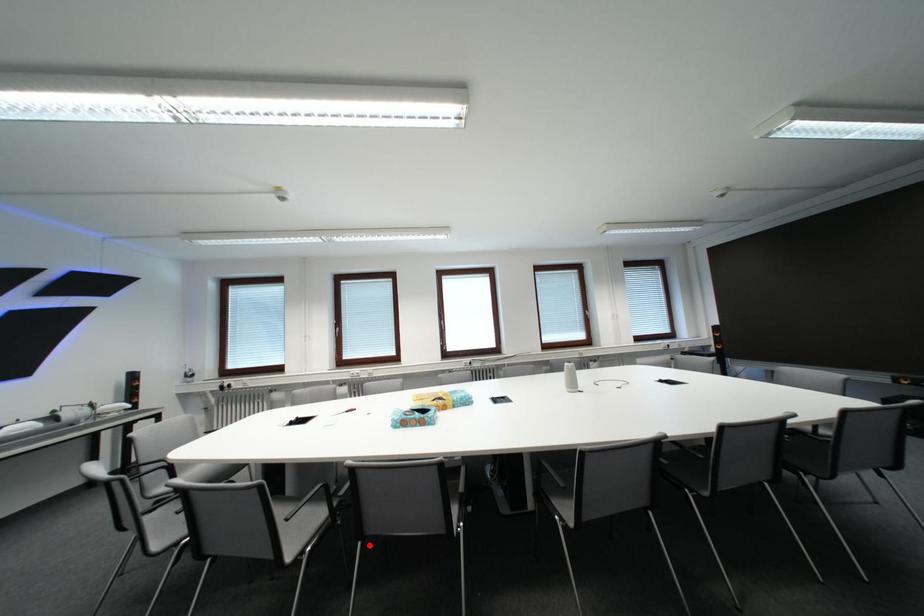
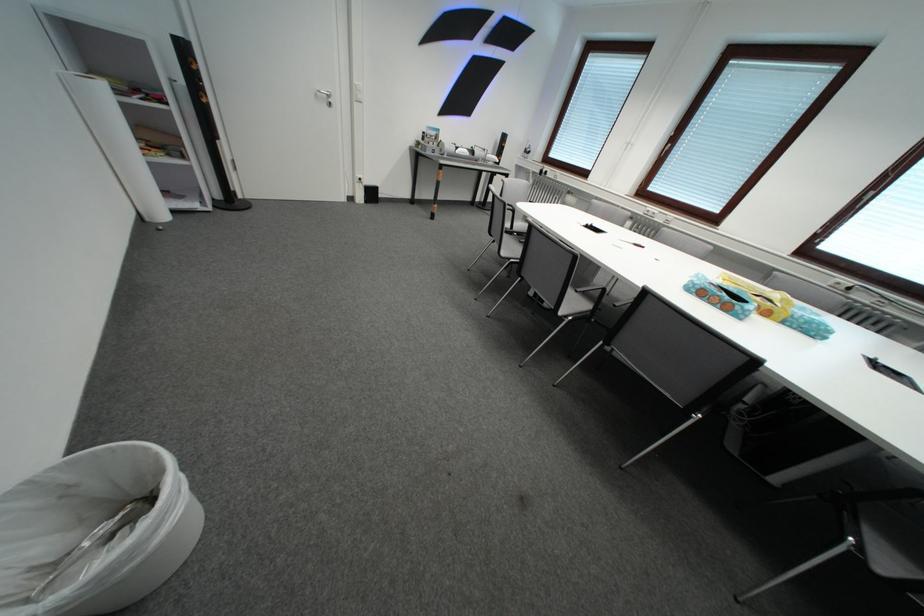
The point at the highlighted location is marked in the first image. Where is the corresponding point in the second image?

(611, 346)